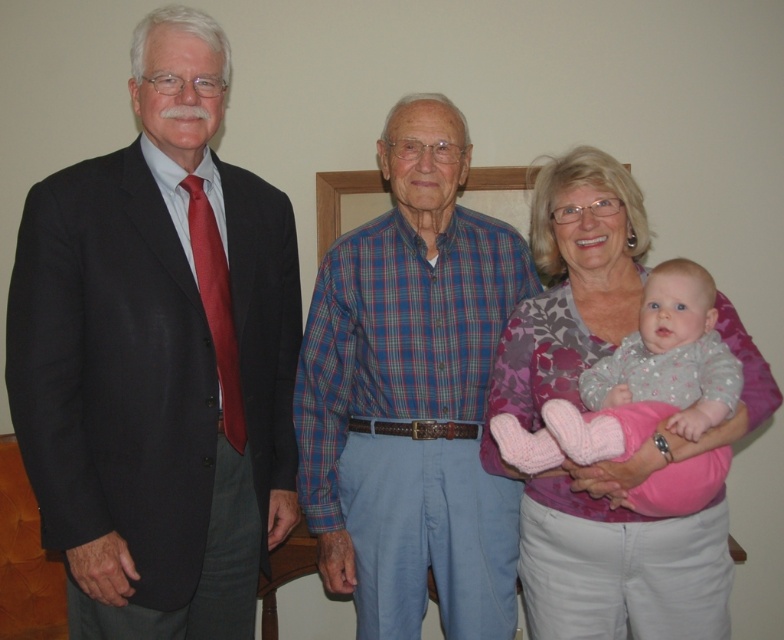
You are trying to decide which item to pack first for a trip. You see the floral fabric shirt at center and the fluffy pink socks at center in your closet. Based on their sizes, which one should you pick up first if you want to pack the larger item first?

The floral fabric shirt at center is wider than the fluffy pink socks at center, so you should pick up the floral fabric shirt at center first.

You are an interior designer assessing the spatial arrangement of clothing items in the image. Given that the matte black suit at left and the floral fabric shirt at center are displayed on hangers in a closet, which item takes up more space vertically?

The floral fabric shirt at center takes up more vertical space because it is larger than the matte black suit at left.

You are a photographer taking a group photo and notice the floral fabric shirt at center and the fluffy pink socks at center in the scene. Which item is located to the left of the other?

The floral fabric shirt at center is positioned on the left side of fluffy pink socks at center, so the floral fabric shirt at center is to the left of the fluffy pink socks at center.